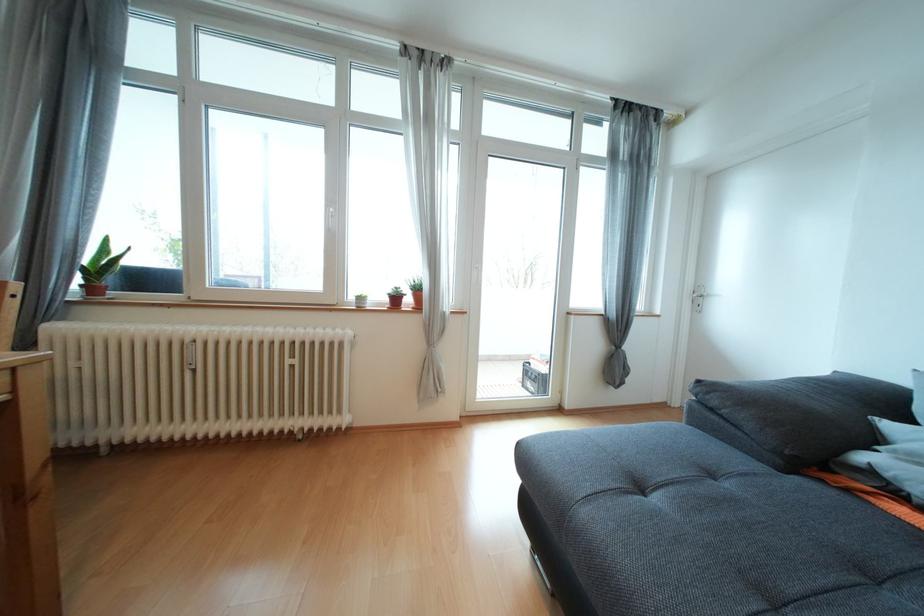
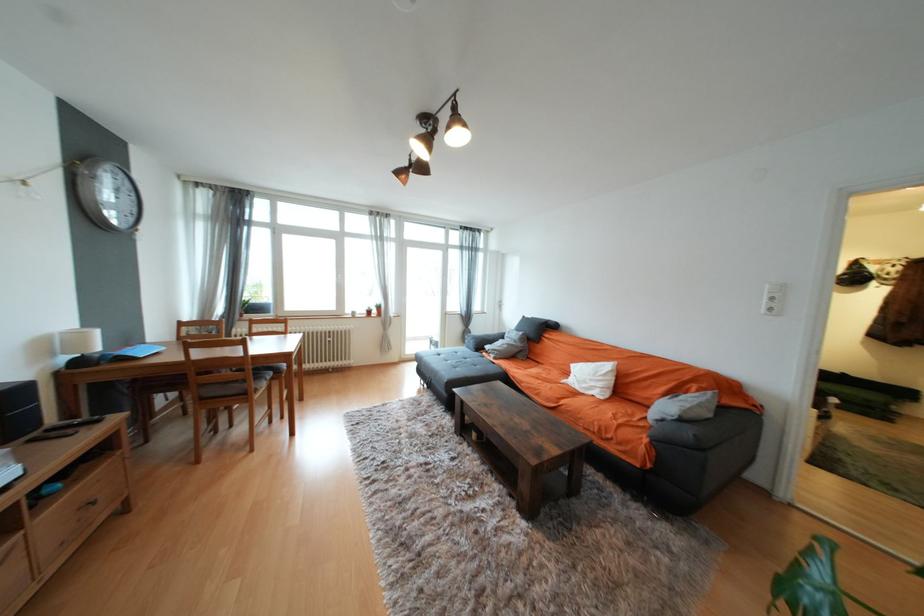
Question: What movement of the cameraman would produce the second image?

Choices:
 (A) Left
 (B) Right
 (C) Forward
 (D) Backward

Answer: (D)